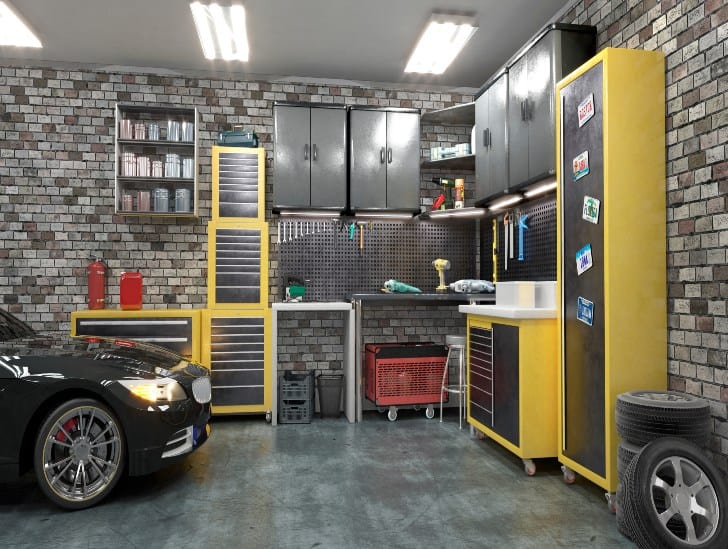
Where is `yellow tall cabinet`? yellow tall cabinet is located at coordinates (628, 274).